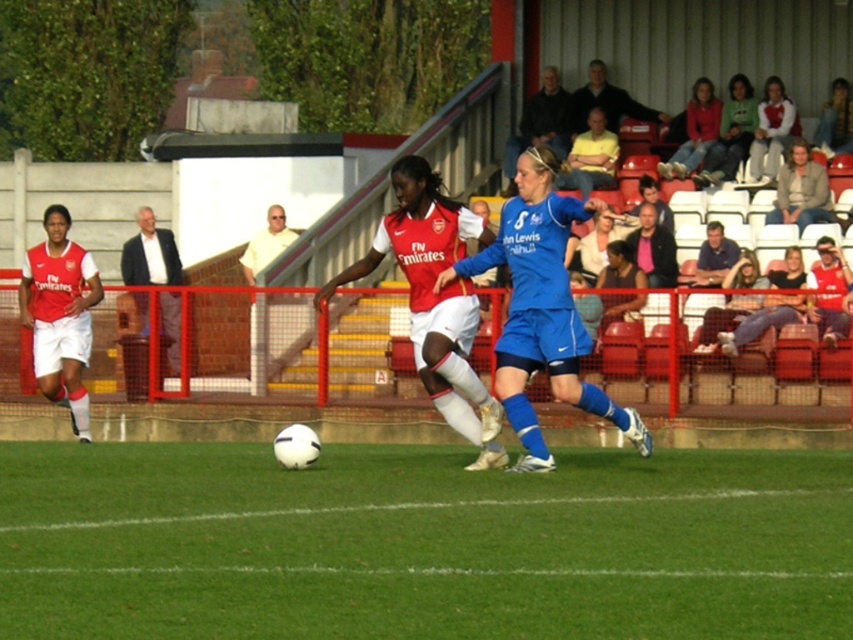
You are a soccer referee positioned at the center of the field. You notice a point at coordinates (434, 300). According to the scene description, which object does this point belong to?

The point at coordinates (434, 300) is on the matte white jersey at center.